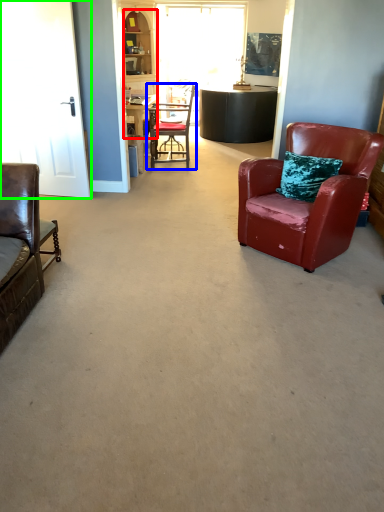
Question: Which object is the closest to the cabinetry (highlighted by a red box)? Choose among these: chair (highlighted by a blue box) or glass door (highlighted by a green box).

Choices:
 (A) chair
 (B) glass door

Answer: (A)